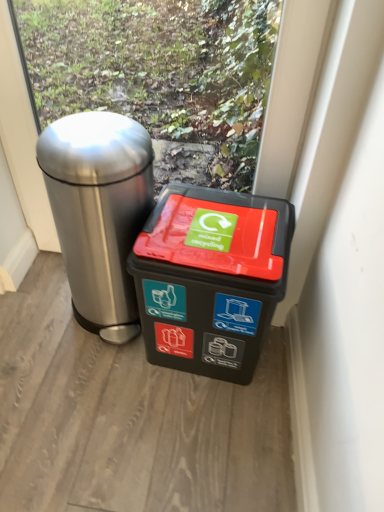
Where is `free space above black plastic recycling bin at center, which is the first waste container from right to left (from a real-world perspective)`? free space above black plastic recycling bin at center, which is the first waste container from right to left (from a real-world perspective) is located at coordinates (226, 222).